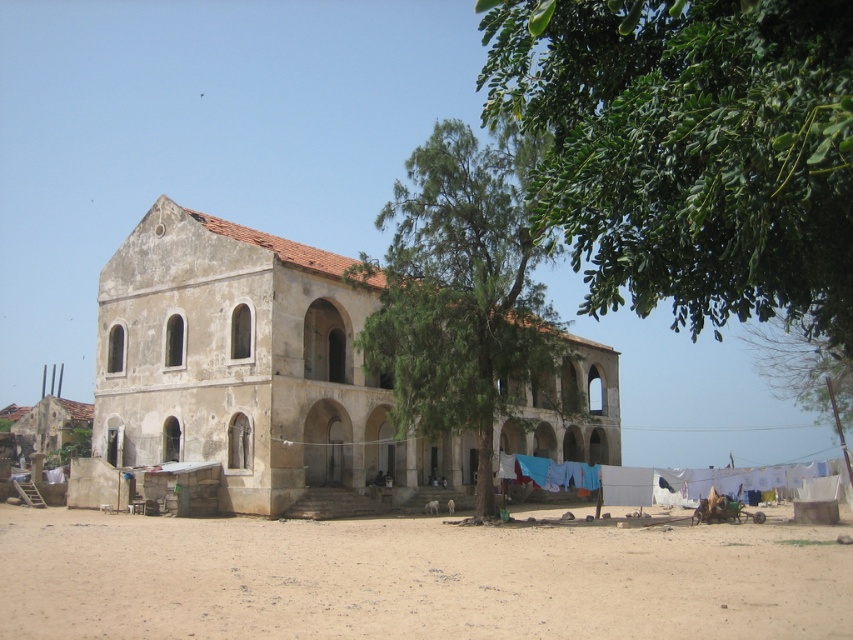
Consider the image. Can you confirm if green leafy tree at upper right is thinner than brown sandy dirt field at lower center?

Yes, green leafy tree at upper right is thinner than brown sandy dirt field at lower center.

Does point (817, 252) lie behind point (21, 550)?

No, it is not.

In the scene shown: Measure the distance between green leafy tree at upper right and camera.

green leafy tree at upper right and camera are 20.72 meters apart from each other.

Where is `green leafy tree at upper right`? Image resolution: width=853 pixels, height=640 pixels. green leafy tree at upper right is located at coordinates (689, 148).

Is beige plaster church at center smaller than green leafy tree at center?

Yes, beige plaster church at center is smaller than green leafy tree at center.

Is point (233, 432) in front of point (427, 344)?

No, (233, 432) is behind (427, 344).

This screenshot has width=853, height=640. I want to click on beige plaster church at center, so click(248, 365).

Who is shorter, green leafy tree at upper right or green leafy tree at center?

With less height is green leafy tree at upper right.

Does green leafy tree at upper right have a lesser height compared to green leafy tree at center?

Yes, green leafy tree at upper right is shorter than green leafy tree at center.

Describe the element at coordinates (689, 148) in the screenshot. I see `green leafy tree at upper right` at that location.

The width and height of the screenshot is (853, 640). I want to click on green leafy tree at upper right, so tap(689, 148).